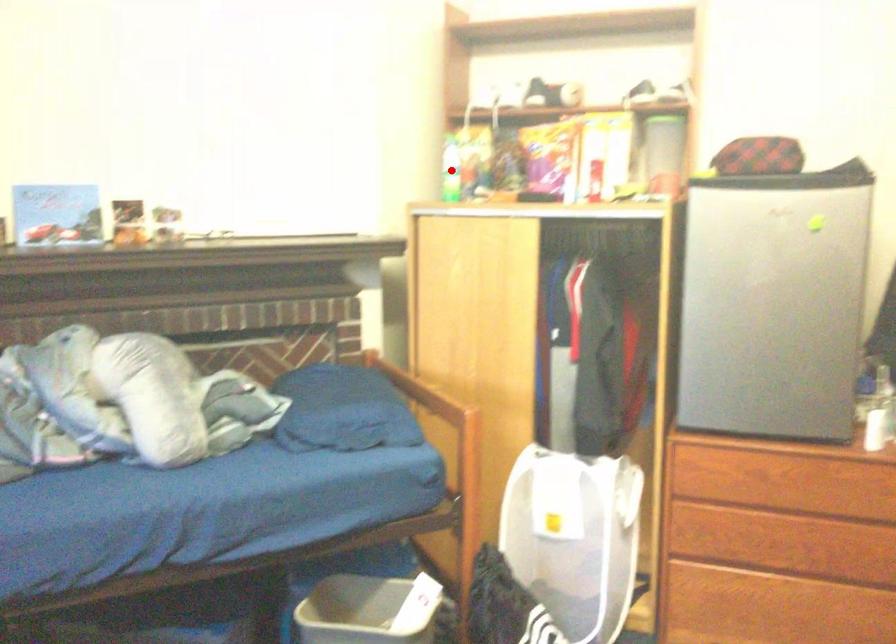
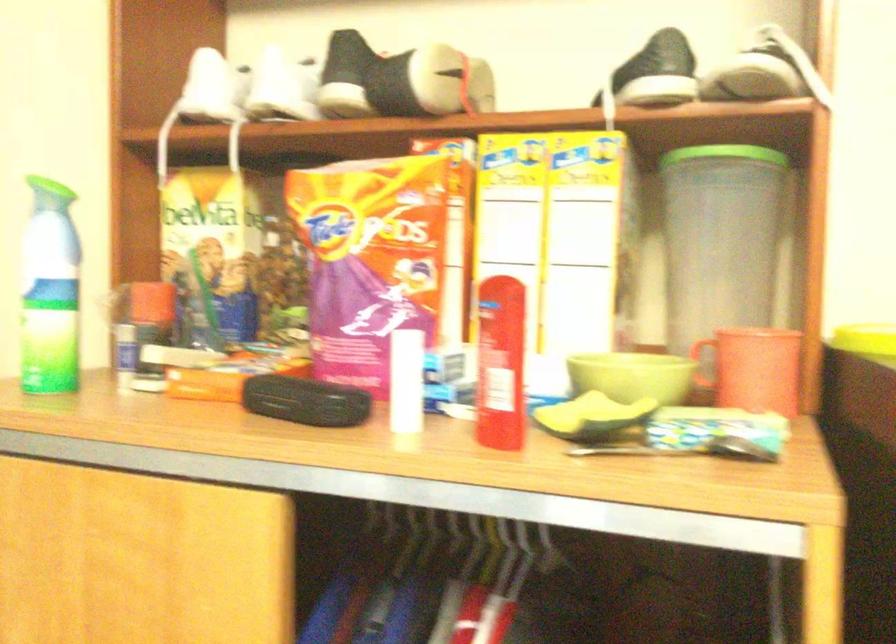
The point at the highlighted location is marked in the first image. Where is the corresponding point in the second image?

(49, 292)